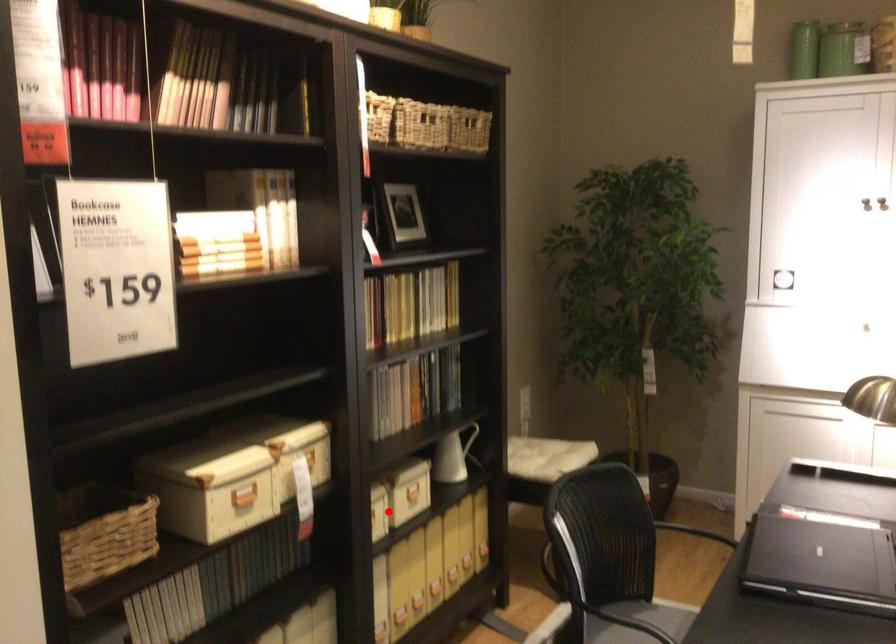
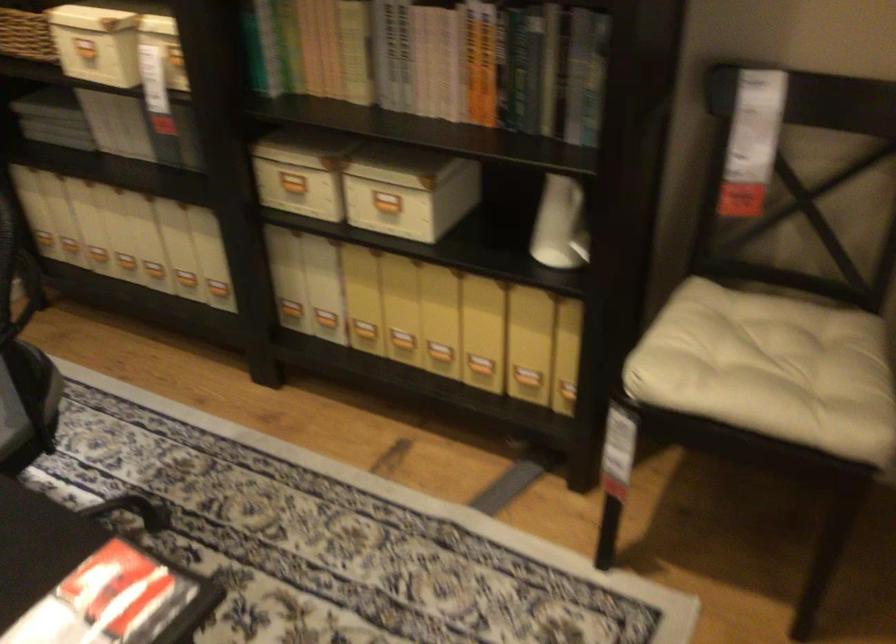
Question: I am providing you with two images of the same scene from different viewpoints. In image1, a red point is highlighted. Considering the same 3D point in image2, which of the following is correct?

Choices:
 (A) It is closer
 (B) It is farther

Answer: (A)